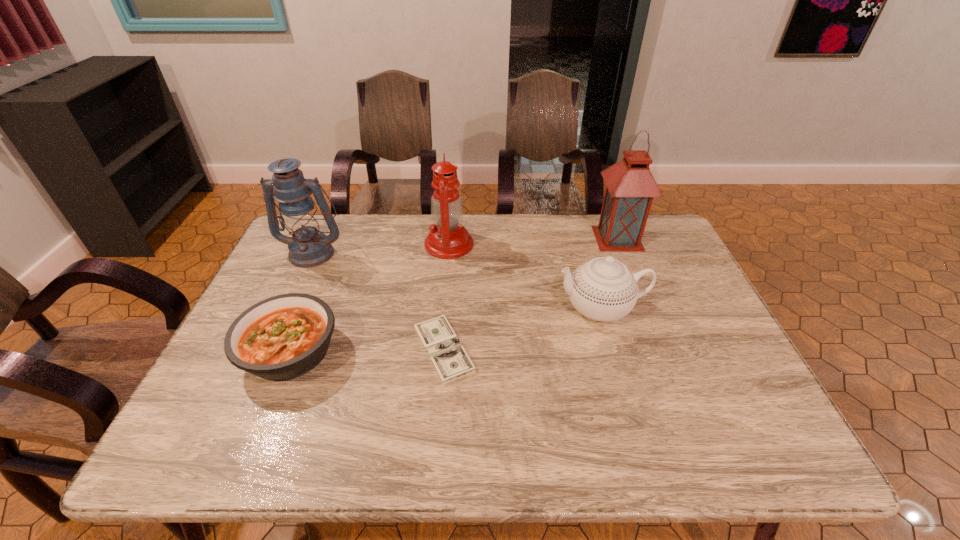
What are the coordinates of `the right lantern` in the screenshot? It's located at (630, 187).

Locate an element on the screen. This screenshot has width=960, height=540. the left lantern is located at coordinates (308, 247).

You are a GUI agent. You are given a task and a screenshot of the screen. Output one action in this format:
    pyautogui.click(x=<x>, y=<y>)
    Task: Click on the oil lamp
    Image resolution: width=960 pixels, height=540 pixels.
    Given the screenshot: What is the action you would take?
    pyautogui.click(x=448, y=239)

Find the location of `chinaware`. chinaware is located at coordinates (603, 289).

You are a GUI agent. You are given a task and a screenshot of the screen. Output one action in this format:
    pyautogui.click(x=<x>, y=<y>)
    Task: Click on the stew
    This screenshot has height=540, width=960.
    Given the screenshot: What is the action you would take?
    pyautogui.click(x=283, y=337)

What are the coordinates of `dollar` in the screenshot? It's located at (449, 358).

Where is `free space located on the front of the right lantern`? free space located on the front of the right lantern is located at coordinates (636, 283).

Identify the location of free spot located on the front-facing side of the left lantern. (298, 284).

Identify the location of free space located on the front of the oil lamp. The image size is (960, 540). (439, 360).

Find the location of a particular element. vacant space located on the spout of the chinaware is located at coordinates (442, 308).